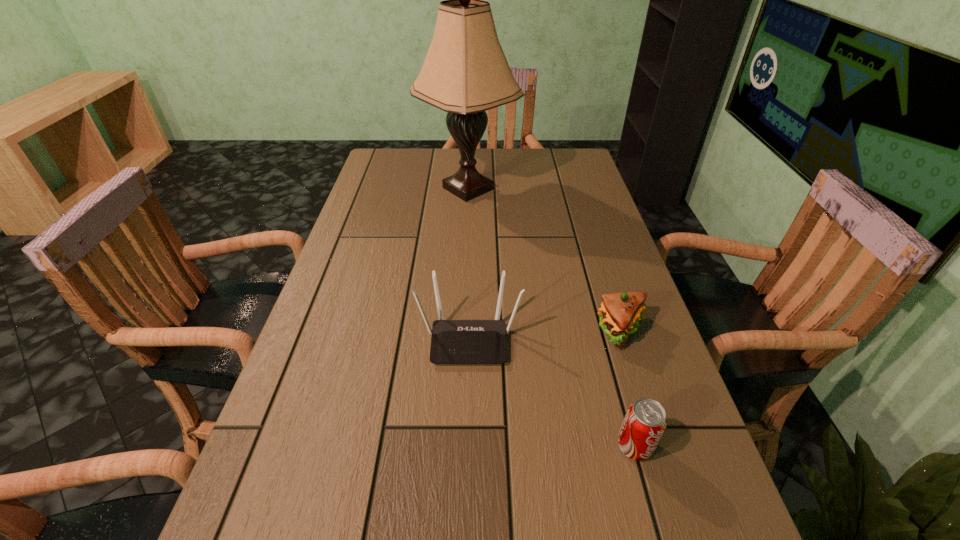
Locate an element on the screen. This screenshot has height=540, width=960. the tallest object is located at coordinates (465, 72).

Image resolution: width=960 pixels, height=540 pixels. I want to click on lamp, so click(x=465, y=72).

At what (x,y) coordinates should I click in order to perform the action: click on router. Please return your answer as a coordinate pair (x, y). Looking at the image, I should click on (453, 341).

Where is `sandwich`? sandwich is located at coordinates (620, 314).

This screenshot has height=540, width=960. What are the coordinates of `soda` in the screenshot? It's located at (645, 421).

You are a GUI agent. You are given a task and a screenshot of the screen. Output one action in this format:
    pyautogui.click(x=<x>, y=<y>)
    Task: Click on the vacant region located on the front of the farthest object
    
    Given the screenshot: What is the action you would take?
    pyautogui.click(x=466, y=253)

Where is `free space located 0.180m on the front-facing side of the router`? Image resolution: width=960 pixels, height=540 pixels. free space located 0.180m on the front-facing side of the router is located at coordinates (467, 450).

The image size is (960, 540). In order to click on blank space located on the front of the sandwich in this screenshot , I will do `click(682, 519)`.

Find the location of `vacant space situated 0.110m on the left of the nearest object`. vacant space situated 0.110m on the left of the nearest object is located at coordinates (554, 446).

Identify the location of object situated at the far edge. The width and height of the screenshot is (960, 540). (465, 72).